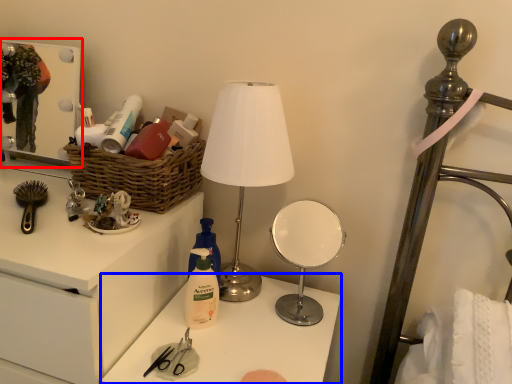
Question: Which object is further to the camera taking this photo, medicine cabinet (highlighted by a red box) or table (highlighted by a blue box)?

Choices:
 (A) medicine cabinet
 (B) table

Answer: (A)